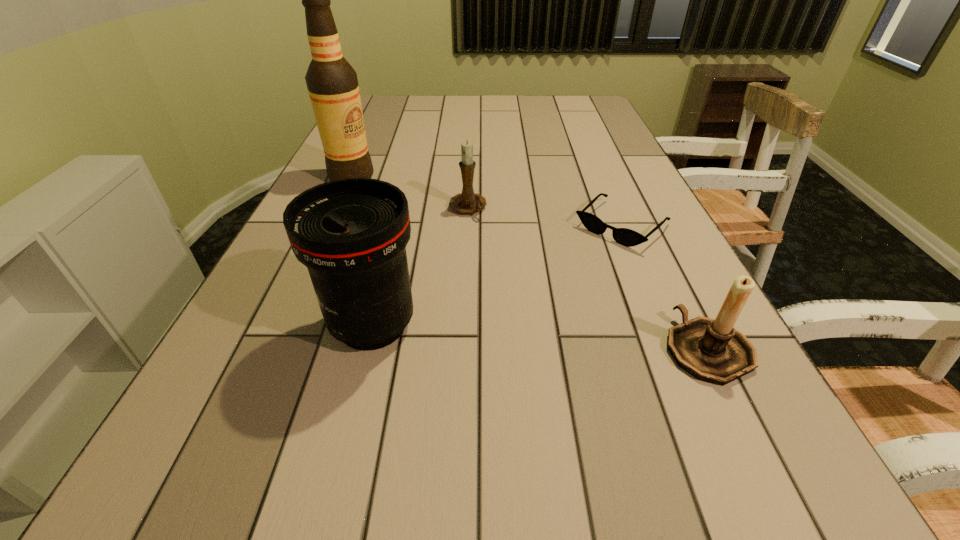
Where is `free space on the desktop that is between the telephoto lens and the nearer candle holder and is positioned on the label of the alcohol`? The width and height of the screenshot is (960, 540). free space on the desktop that is between the telephoto lens and the nearer candle holder and is positioned on the label of the alcohol is located at coordinates (492, 333).

Identify the location of vacant space on the desktop that is between the fourth object from right to left and the nearer candle holder and is positioned on the side of the third object from right to left with the handle. (570, 339).

At what (x,y) coordinates should I click in order to perform the action: click on vacant spot on the desktop that is between the telephoto lens and the nearer candle holder and is positioned on the front-facing side of the sunglasses. Please return your answer as a coordinate pair (x, y). The width and height of the screenshot is (960, 540). Looking at the image, I should click on tap(505, 334).